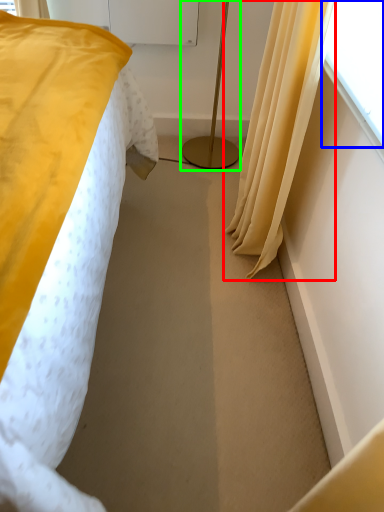
Question: Based on their relative distances, which object is nearer to curtain (highlighted by a red box)? Choose from window screen (highlighted by a blue box) and bedside lamp (highlighted by a green box).

Choices:
 (A) window screen
 (B) bedside lamp

Answer: (A)